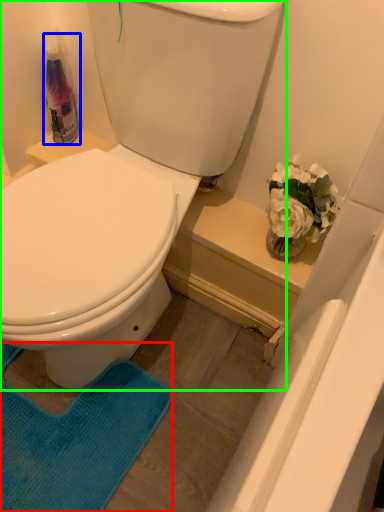
Question: Considering the real-world distances, which object is farthest from yoga mat (highlighted by a red box)? cleaning product (highlighted by a blue box) or toilet (highlighted by a green box)?

Choices:
 (A) cleaning product
 (B) toilet

Answer: (A)